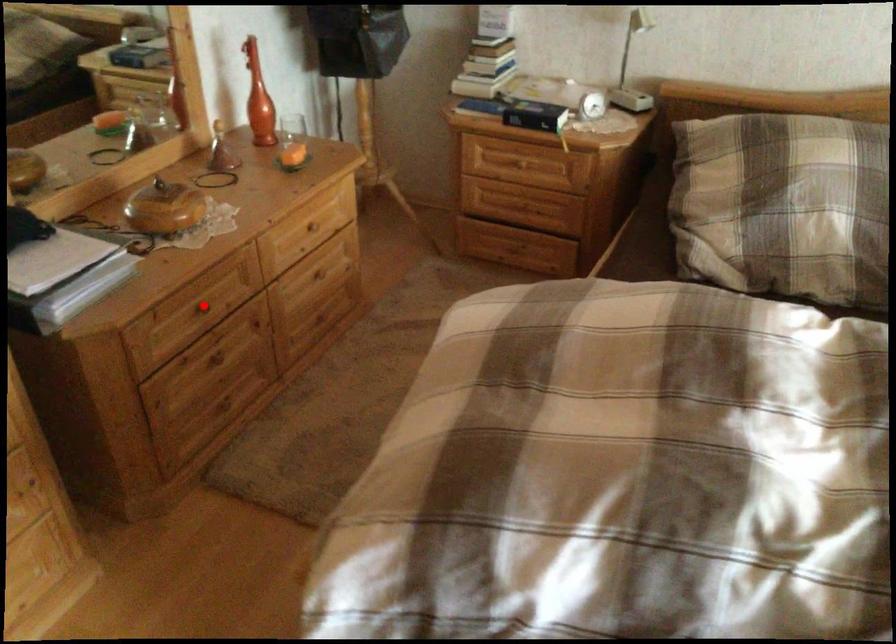
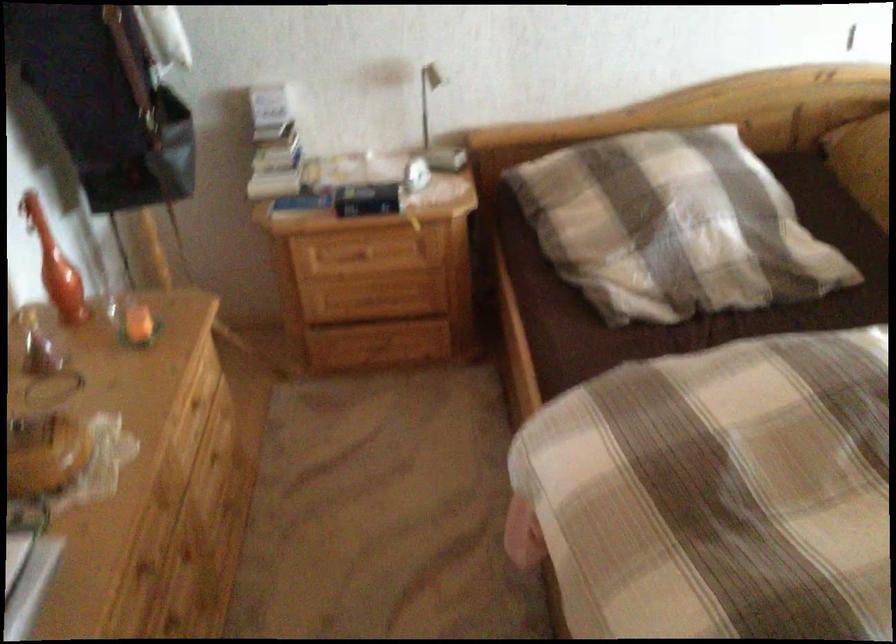
In the second image, find the point that corresponds to the highlighted location in the first image.

(144, 565)